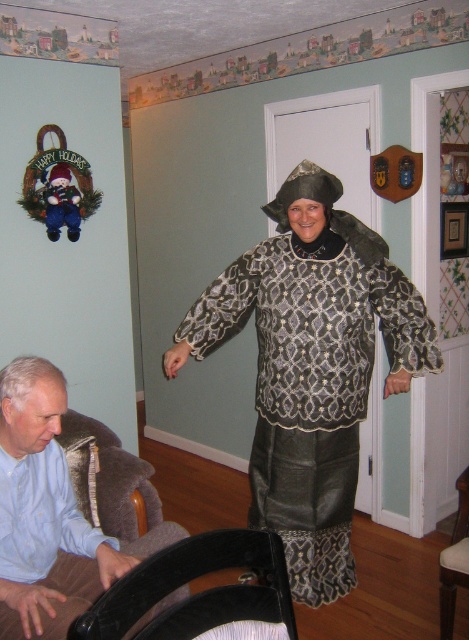
You are organizing a charity event and need to decide which clothing item to display first. The matte black dress at center and the light blue shirt at lower left are both available. Based on their sizes, which one should you choose to ensure it can be seen clearly from a distance?

The matte black dress at center is bigger than the light blue shirt at lower left, so it should be displayed first as it can be seen more clearly from a distance due to its larger size.

You are a photographer setting up a shoot in this room. You need to place a large camera on the floor between the light blue shirt at lower left and the black leather armchair at lower left. Which object should the camera be closer to if you want to ensure it doesn

The light blue shirt at lower left has a larger size compared to the black leather armchair at lower left. Therefore, the camera should be placed closer to the black leather armchair at lower left to maintain balance between the two objects.

You are planning to take a photo of the matte black dress at center and the black leather armchair at lower left from the front of the room. Which object will appear closer to the camera in the photo?

The matte black dress at center will appear closer to the camera in the photo because the black leather armchair at lower left is behind it.